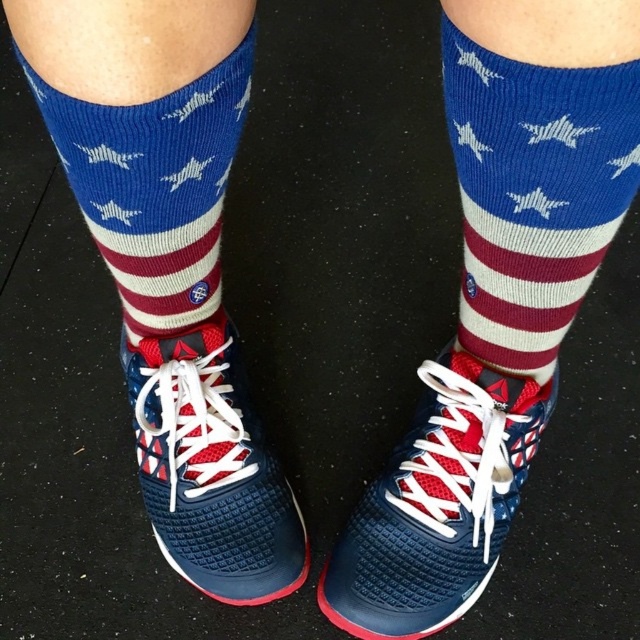
You are a fashion designer observing the image of a person wearing blue knitted sock at upper center and american flag socks at center. Which sock is positioned higher on the leg?

The blue knitted sock at upper center is positioned higher on the leg than the american flag socks at center.

You are designing a virtual fitting room and need to place a blue knitted sock at upper center on a mannequin. According to the image, where should you position it in terms of coordinates?

The blue knitted sock at upper center should be positioned at coordinates point [534,192].

You are trying to determine which sock is longer between the blue knitted sock at upper center and the american flag socks at center. Which one is taller?

The blue knitted sock at upper center is much taller than the american flag socks at center according to the description.